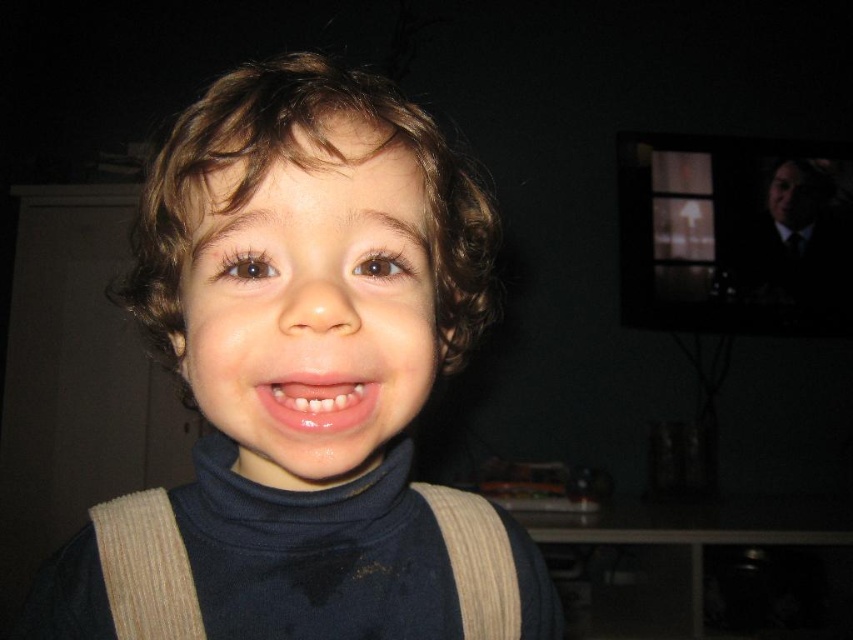
Is dark blue turtleneck sweater at center below smooth skin face at center?

Incorrect, dark blue turtleneck sweater at center is not positioned below smooth skin face at center.

From the picture: Is dark blue turtleneck sweater at center behind smooth skin face at center?

That is False.

Who is more distant from viewer, [309,221] or [387,218]?

Point [387,218]

Locate an element on the screen. The image size is (853, 640). dark blue turtleneck sweater at center is located at coordinates (303, 371).

Based on the photo, is smooth skin face at center to the right of glossy pink lips at center from the viewer's perspective?

No, smooth skin face at center is not to the right of glossy pink lips at center.

Is smooth skin face at center positioned behind glossy pink lips at center?

No, smooth skin face at center is in front of glossy pink lips at center.

Does point (352, 387) come in front of point (276, 408)?

No, (352, 387) is further to viewer.

At what (x,y) coordinates should I click in order to perform the action: click on smooth skin face at center. Please return your answer as a coordinate pair (x, y). This screenshot has width=853, height=640. Looking at the image, I should click on (312, 305).

Can you confirm if dark blue turtleneck sweater at center is smaller than glossy pink lips at center?

No, dark blue turtleneck sweater at center is not smaller than glossy pink lips at center.

The width and height of the screenshot is (853, 640). What do you see at coordinates (303, 371) in the screenshot?
I see `dark blue turtleneck sweater at center` at bounding box center [303, 371].

Find the location of a particular element. dark blue turtleneck sweater at center is located at coordinates (303, 371).